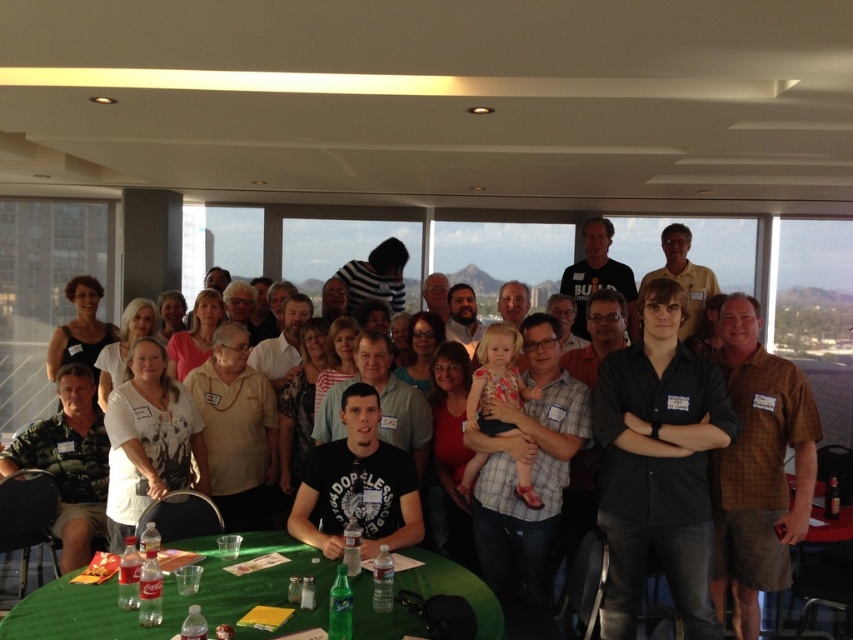
Which is below, black matte shirt at center or green fabric table at lower center?

green fabric table at lower center is below.

Does black matte shirt at center have a greater height compared to green fabric table at lower center?

Yes.

Measure the distance between point (599, 435) and camera.

Point (599, 435) is 3.12 meters away from camera.

The width and height of the screenshot is (853, 640). Find the location of `black matte shirt at center`. black matte shirt at center is located at coordinates (659, 465).

Between black matte shirt at center and brown plaid shirt at right, which one is positioned higher?

black matte shirt at center is above.

Can you confirm if black matte shirt at center is shorter than brown plaid shirt at right?

Yes, black matte shirt at center is shorter than brown plaid shirt at right.

Locate an element on the screen. The height and width of the screenshot is (640, 853). black matte shirt at center is located at coordinates (659, 465).

Does brown plaid shirt at right appear on the left side of green fabric table at lower center?

In fact, brown plaid shirt at right is to the right of green fabric table at lower center.

Consider the image. Does brown plaid shirt at right have a smaller size compared to green fabric table at lower center?

No, brown plaid shirt at right is not smaller than green fabric table at lower center.

Is point (740, 509) behind point (41, 616)?

That is True.

Identify the location of brown plaid shirt at right. (758, 467).